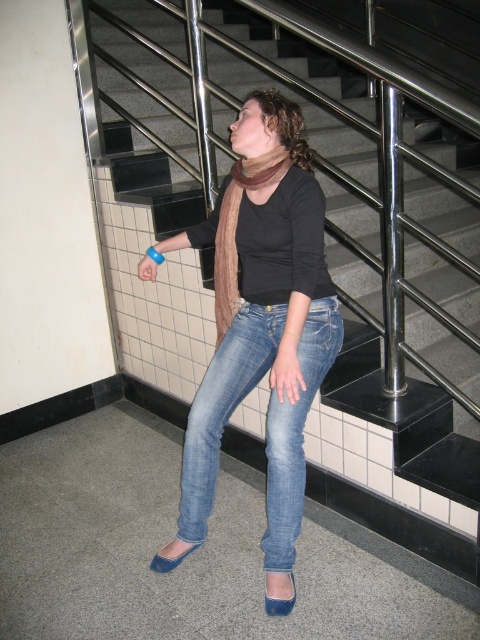
Question: Which is farther from the denim jeans at center?

Choices:
 (A) black tile stairs at center
 (B) blue rubber wristband at upper center
 (C) brown textured scarf at center
 (D) jeans at center

Answer: (A)

Question: Among these objects, which one is nearest to the camera?

Choices:
 (A) blue rubber wristband at upper center
 (B) denim jeans at center

Answer: (B)

Question: Which point appears closest to the camera in this image?

Choices:
 (A) (375, 198)
 (B) (189, 461)
 (C) (272, 608)

Answer: (C)

Question: Can you confirm if denim jeans at center is thinner than blue rubber wristband at upper center?

Choices:
 (A) yes
 (B) no

Answer: (B)

Question: Can you confirm if denim jeans at center is smaller than brown textured scarf at center?

Choices:
 (A) yes
 (B) no

Answer: (B)

Question: Can you confirm if denim jeans at center is positioned below blue rubber wristband at upper center?

Choices:
 (A) yes
 (B) no

Answer: (A)